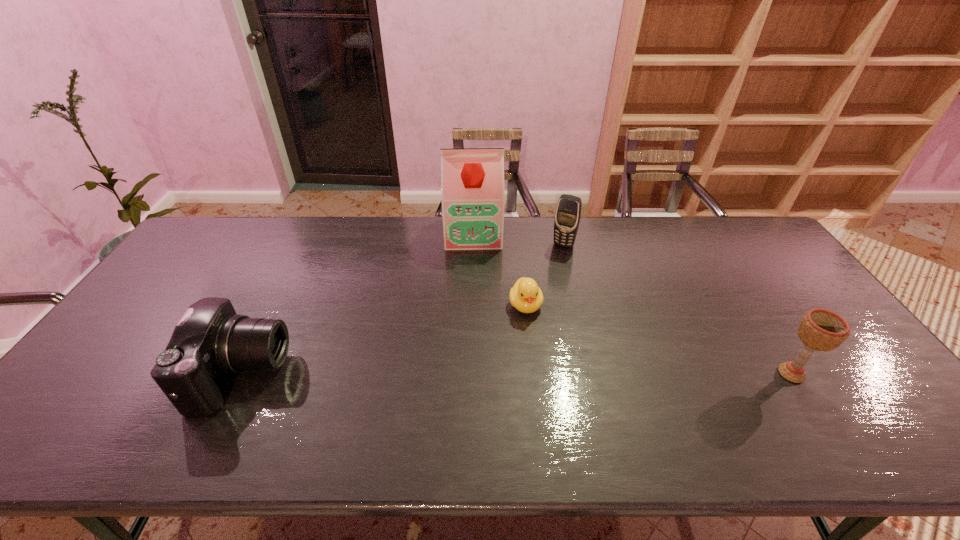
You are a GUI agent. You are given a task and a screenshot of the screen. Output one action in this format:
    pyautogui.click(x=<x>, y=<y>)
    Task: Click on the vacant space that is in between the chalice and the tallest object
    The height and width of the screenshot is (540, 960).
    Given the screenshot: What is the action you would take?
    pyautogui.click(x=632, y=303)

Identify the location of vacant area between the third object from left to right and the soya milk. (499, 269).

The height and width of the screenshot is (540, 960). I want to click on free spot between the duckling and the rightmost object, so click(659, 339).

At what (x,y) coordinates should I click in order to perform the action: click on empty space that is in between the soya milk and the second object from right to left. Please return your answer as a coordinate pair (x, y). This screenshot has height=540, width=960. Looking at the image, I should click on (518, 239).

Find the location of a particular element. The height and width of the screenshot is (540, 960). free space between the rightmost object and the fourth object from left to right is located at coordinates (678, 309).

Where is `empty location between the rightmost object and the shortest object`? The height and width of the screenshot is (540, 960). empty location between the rightmost object and the shortest object is located at coordinates (659, 339).

Where is `vacant area that lies between the soya milk and the shortest object`? This screenshot has height=540, width=960. vacant area that lies between the soya milk and the shortest object is located at coordinates (499, 269).

At what (x,y) coordinates should I click in order to perform the action: click on vacant area that lies between the second object from left to right and the third object from left to right. Please return your answer as a coordinate pair (x, y). Looking at the image, I should click on (499, 269).

Identify which object is the third nearest to the cellular telephone. Please provide its 2D coordinates. Your answer should be formatted as a tuple, i.e. [(x, y)], where the tuple contains the x and y coordinates of a point satisfying the conditions above.

[(822, 330)]

Where is `the third closest object to the rightmost object`? The image size is (960, 540). the third closest object to the rightmost object is located at coordinates (472, 180).